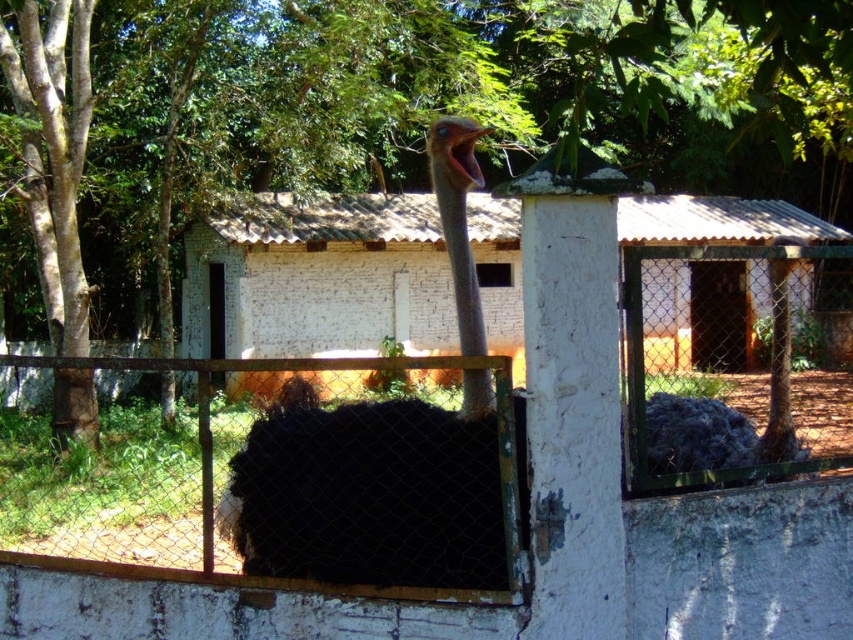
You are standing in front of the enclosure and want to see both the green leafy tree at upper center and the black feathered ostrich at center. Which object is nearer to you?

The green leafy tree at upper center is closer to the viewer than the black feathered ostrich at center.

You are a drone operator trying to capture a closeup of the white brick hut at center. Your drone is currently 5 meters away from the hut. How much distance does the drone need to cover to reach the optimal 3.23 meter distance for the shot?

The drone needs to move closer by 1.77 meters to achieve the optimal 3.23 meter distance from the white brick hut at center for the closeup shot.

You are a farmer who needs to feed the ostrich. The food is placed at the white brick hut at center. Can you reach the food from the black feathered ostrich at center without moving more than 8 meters?

The white brick hut at center and black feathered ostrich at center are 7.96 meters apart, so yes, the farmer can reach the food from the black feathered ostrich at center without moving more than 8 meters since the distance is less than 8 meters.